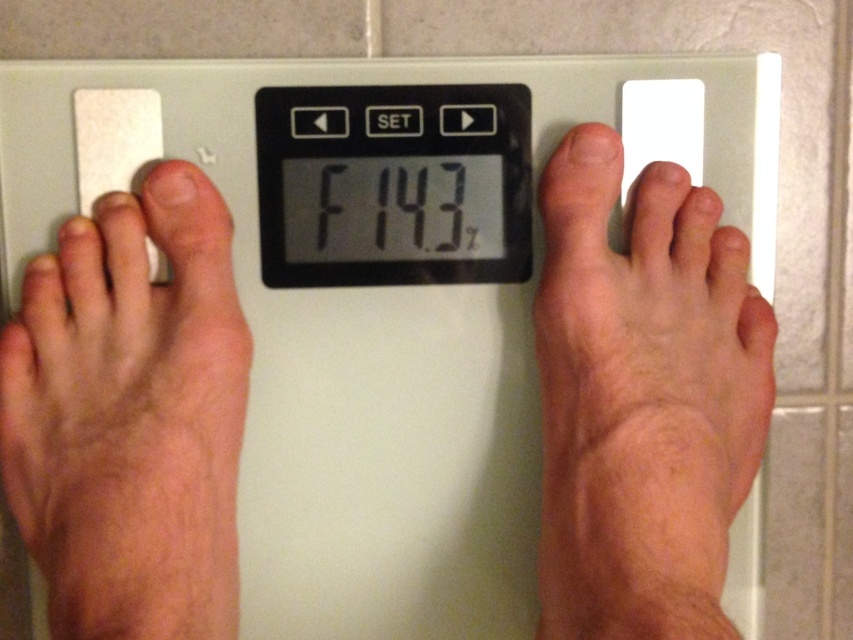
Question: Does smooth skin foot at right have a lesser width compared to white plastic scale at center?

Choices:
 (A) no
 (B) yes

Answer: (B)

Question: Is the position of smooth skin foot at right less distant than that of dry skin at left?

Choices:
 (A) yes
 (B) no

Answer: (A)

Question: Does dry skin at left appear over black plastic scale at center?

Choices:
 (A) no
 (B) yes

Answer: (A)

Question: Which object appears closest to the camera in this image?

Choices:
 (A) skinny bare feet at center
 (B) smooth skin foot at right
 (C) white plastic scale at center
 (D) dry skin at left

Answer: (B)

Question: Estimate the real-world distances between objects in this image. Which object is closer to the dry skin at left?

Choices:
 (A) black plastic scale at center
 (B) white plastic scale at center
 (C) skinny bare feet at center

Answer: (C)

Question: Among these objects, which one is farthest from the camera?

Choices:
 (A) black plastic scale at center
 (B) white plastic scale at center
 (C) skinny bare feet at center
 (D) dry skin at left

Answer: (A)